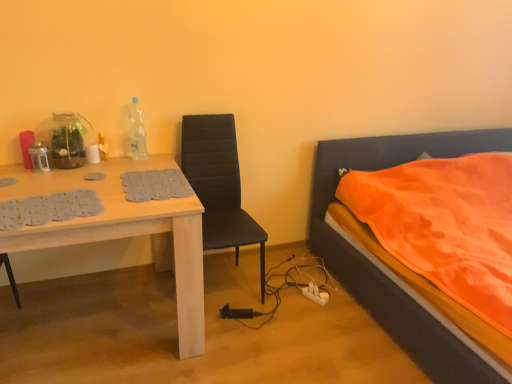
The image size is (512, 384). I want to click on vacant area located to the right-hand side of white plastic power outlet at lower center, so click(x=342, y=302).